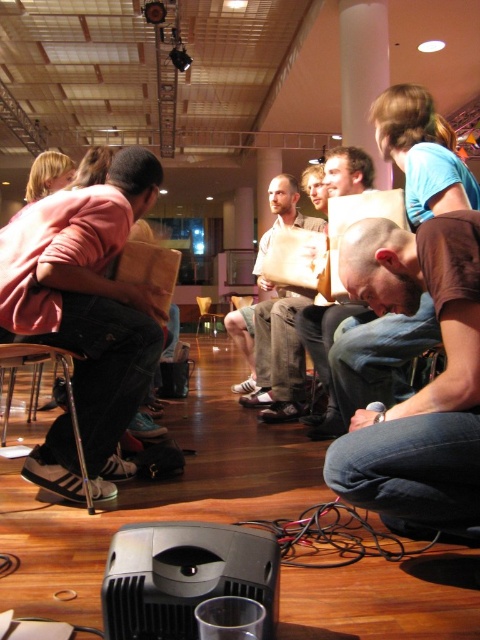
Question: Can you confirm if brown cotton shirt at lower right is positioned above light brown fabric shirt at center?

Choices:
 (A) yes
 (B) no

Answer: (B)

Question: Among these points, which one is nearest to the camera?

Choices:
 (A) (90, 481)
 (B) (300, 349)
 (C) (199, 330)
 (D) (474, 509)

Answer: (D)

Question: Is matte pink shirt at left to the left of wooden chair at center from the viewer's perspective?

Choices:
 (A) no
 (B) yes

Answer: (A)

Question: Which point is farther to the camera?

Choices:
 (A) light brown fabric shirt at center
 (B) matte pink shirt at left
 (C) wooden chair at center

Answer: (C)

Question: Can you confirm if matte pink shirt at left is thinner than brown cotton shirt at lower right?

Choices:
 (A) yes
 (B) no

Answer: (B)

Question: Among these objects, which one is farthest from the camera?

Choices:
 (A) light brown fabric shirt at center
 (B) brown cotton shirt at lower right

Answer: (A)